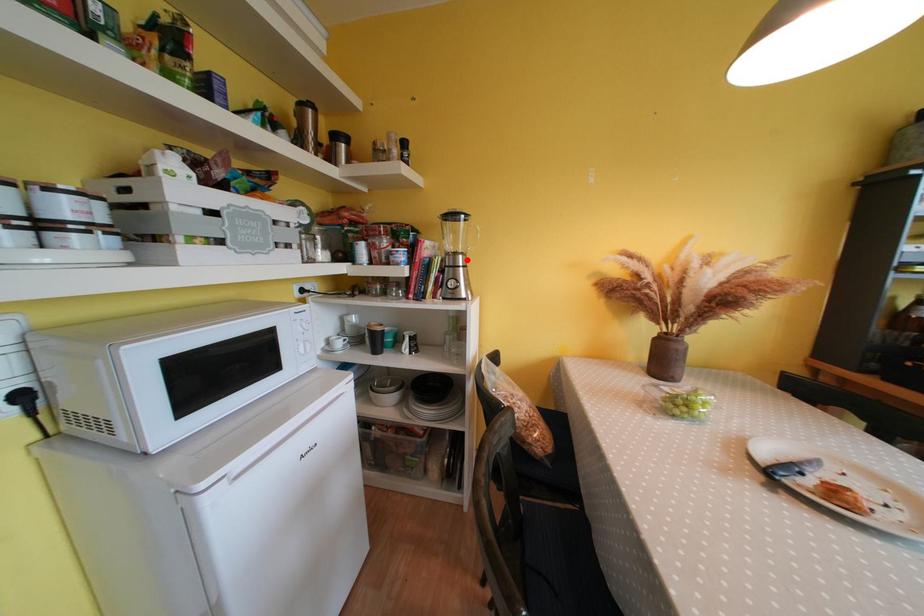
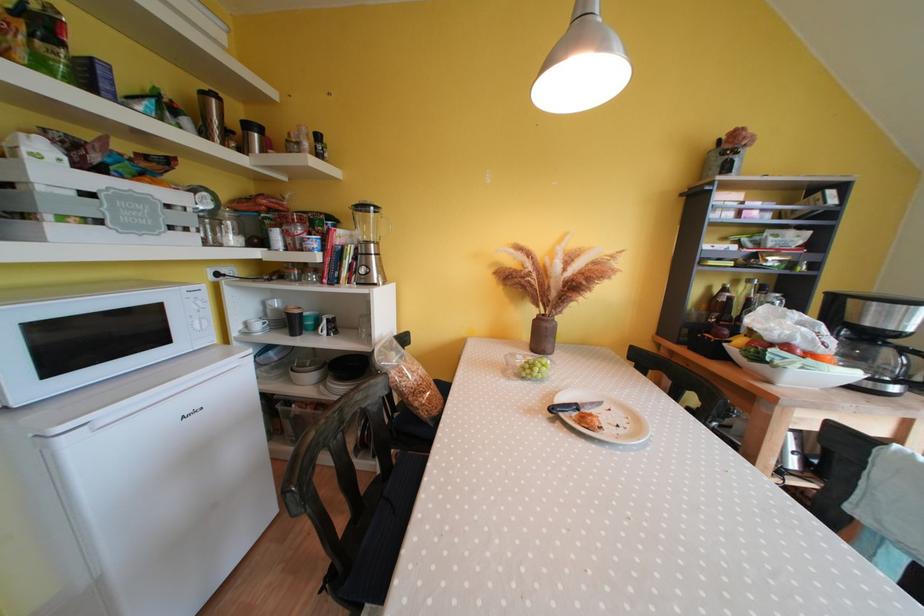
The point at the highlighted location is marked in the first image. Where is the corresponding point in the second image?

(379, 249)